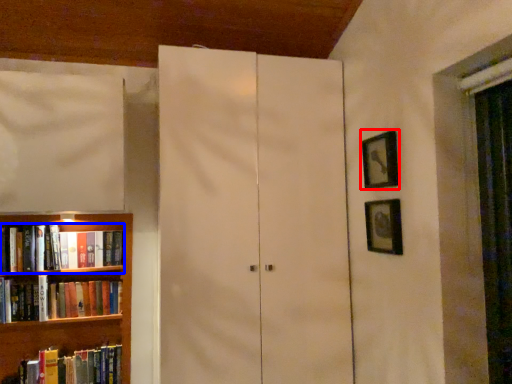
Question: Which of the following is the farthest to the observer, picture frame (highlighted by a red box) or book (highlighted by a blue box)?

Choices:
 (A) picture frame
 (B) book

Answer: (B)